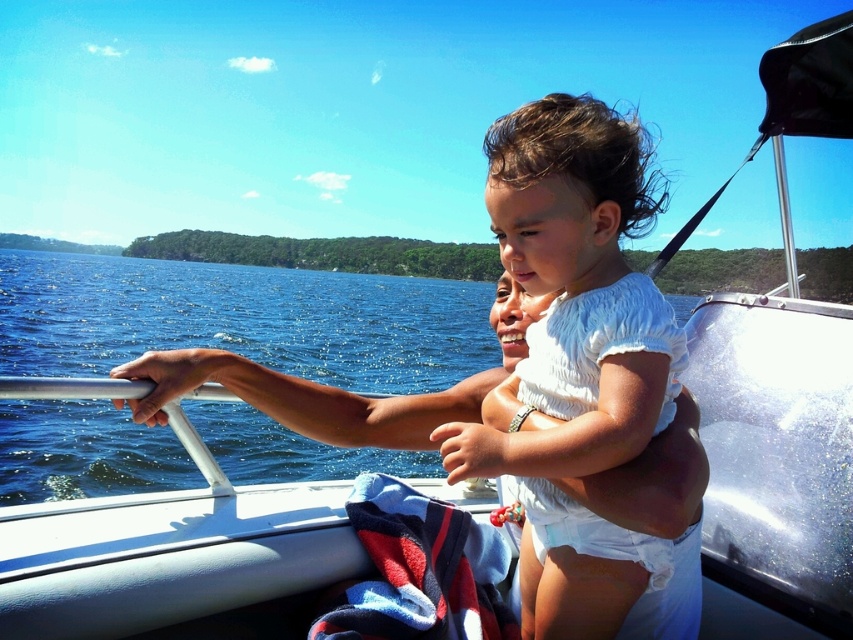
Does point (97, 340) come behind point (579, 433)?

Yes, it is.

Who is higher up, blue water at left or white cotton toddler at center?

blue water at left is higher up.

Between point (201, 276) and point (564, 240), which one is positioned in front?

Positioned in front is point (564, 240).

Identify the location of blue water at left. (241, 320).